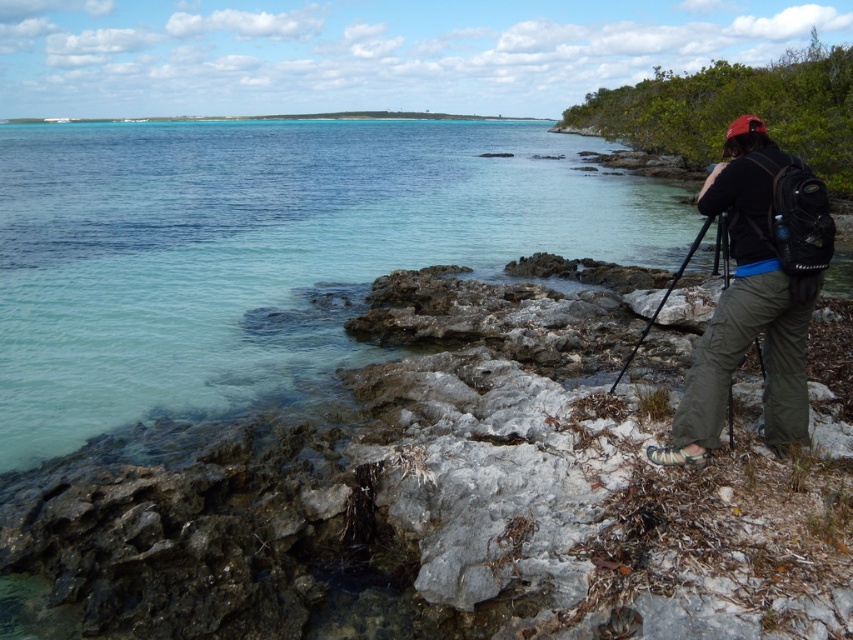
Question: Does clear water at center come in front of dark gray pants at right?

Choices:
 (A) no
 (B) yes

Answer: (A)

Question: Estimate the real-world distances between objects in this image. Which object is farther from the dark gray pants at right?

Choices:
 (A) black matte tripod at right
 (B) clear water at center

Answer: (B)

Question: Does dark gray pants at right have a larger size compared to black matte tripod at right?

Choices:
 (A) no
 (B) yes

Answer: (A)

Question: Which object is the farthest from the black matte tripod at right?

Choices:
 (A) clear water at center
 (B) dark gray pants at right

Answer: (A)

Question: Is clear water at center further to the viewer compared to dark gray pants at right?

Choices:
 (A) no
 (B) yes

Answer: (B)

Question: Among these points, which one is farthest from the camera?

Choices:
 (A) (757, 260)
 (B) (432, 141)
 (C) (645, 324)

Answer: (B)